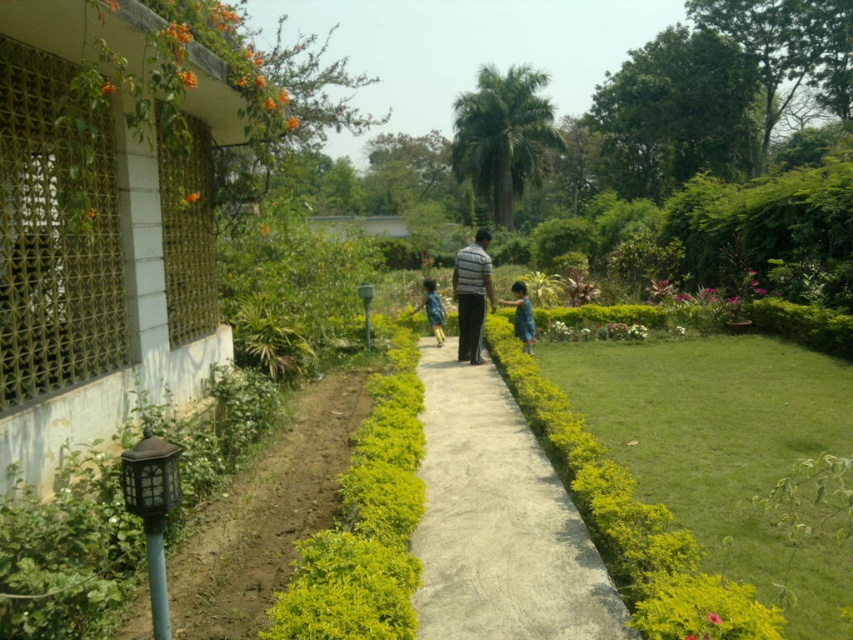
You are a photographer setting up a shoot in the garden. You have two subjects to photograph today, the striped fabric man at center and the green matte dress at center. Since you want to capture both in the same frame, you need to adjust your camera angle. Considering their heights, which subject should you aim the camera towards to ensure both are visible without cropping?

The striped fabric man at center is much taller than the green matte dress at center. To capture both in the same frame without cropping, you should aim the camera slightly upwards to include the full height of the striped fabric man while still showing the green matte dress at center at the lower part of the frame.

You are a fashion designer observing a model wearing a green matte dress at center and blue denim shorts at center. Which clothing item is narrower?

The green matte dress at center has a lesser width compared to the blue denim shorts at center, so the green matte dress at center is narrower.

You are standing on the smooth concrete path at center in the garden scene. You want to hand a note to the striped fabric man at center. Since you can only reach up to 1.7 meters, can you reach him?

The smooth concrete path at center is located below striped fabric man at center, so the striped fabric man at center is standing on higher ground. Since you can only reach up to 1.7 meters, you may not be able to reach him unless he steps down.